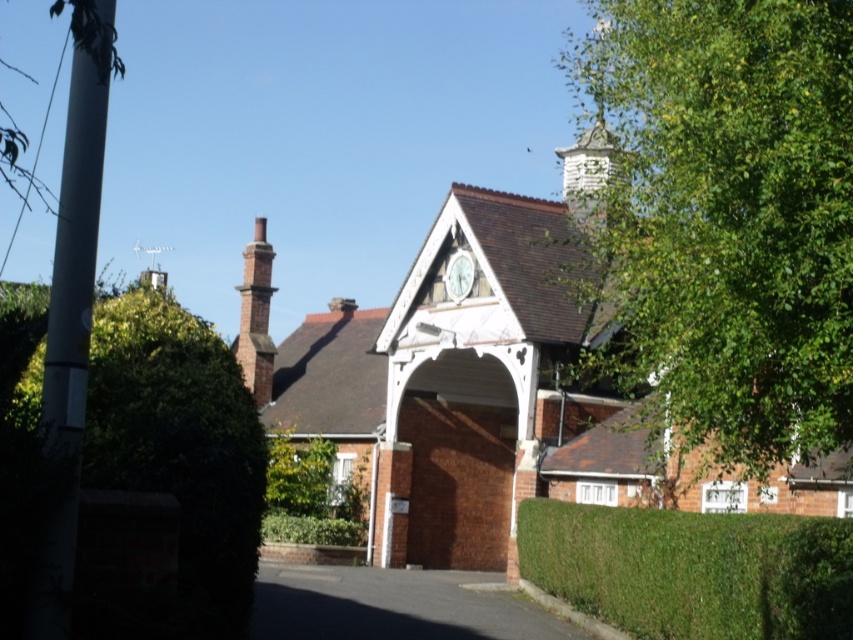
Which is more to the right, white plastic pole at left or white textured chimney at upper right?

white textured chimney at upper right

Is white plastic pole at left to the left of white textured chimney at upper right from the viewer's perspective?

Yes, white plastic pole at left is to the left of white textured chimney at upper right.

What do you see at coordinates (71, 308) in the screenshot? I see `white plastic pole at left` at bounding box center [71, 308].

Identify the location of white plastic pole at left. This screenshot has width=853, height=640. (71, 308).

Who is positioned more to the right, green leafy hedge at lower right or white plastic pole at left?

From the viewer's perspective, green leafy hedge at lower right appears more on the right side.

Does green leafy hedge at lower right appear over white plastic pole at left?

No.

The width and height of the screenshot is (853, 640). I want to click on green leafy hedge at lower right, so click(692, 570).

Between point (780, 417) and point (115, 371), which one is positioned in front?

Point (115, 371) is more forward.

Does green leafy tree at upper right have a greater width compared to green leafy hedge at left?

Incorrect, green leafy tree at upper right's width does not surpass green leafy hedge at left's.

This screenshot has height=640, width=853. In order to click on green leafy tree at upper right in this screenshot , I will do `click(726, 220)`.